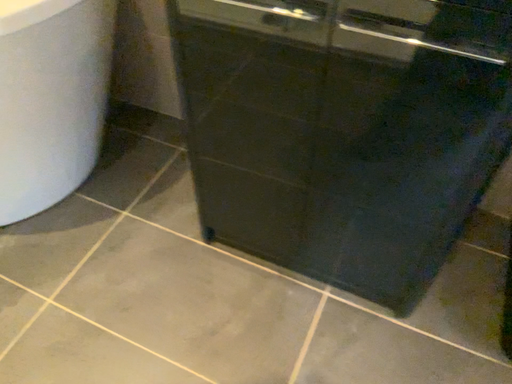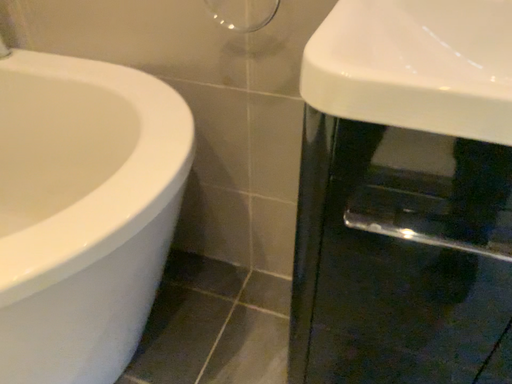
Question: How did the camera likely rotate when shooting the video?

Choices:
 (A) rotated downward
 (B) rotated upward

Answer: (B)